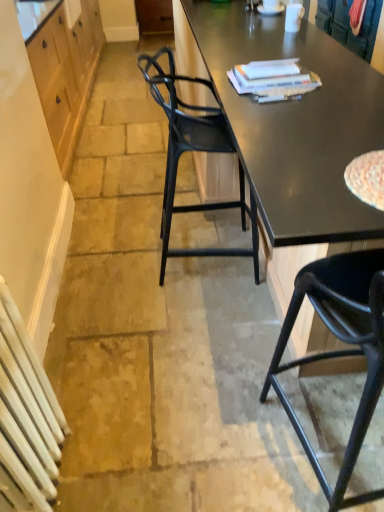
Question: Is white matte plate at upper center inside or outside of wooden cabinet at upper left?

Choices:
 (A) outside
 (B) inside

Answer: (A)

Question: Considering the positions of white matte plate at upper center and wooden cabinet at upper left in the image, is white matte plate at upper center bigger or smaller than wooden cabinet at upper left?

Choices:
 (A) small
 (B) big

Answer: (A)

Question: Which object is positioned farthest from the black plastic chair at lower right, placed as the 1th chair when sorted from front to back?

Choices:
 (A) white matte plate at upper center
 (B) wooden cabinet at left
 (C) white glossy coffee cup at upper center
 (D) wooden cabinet at upper left
 (E) black plastic chair at center, the first chair viewed from the back

Answer: (A)

Question: Which object is the closest to the wooden cabinet at upper left?

Choices:
 (A) white matte plate at upper center
 (B) white glossy coffee cup at upper center
 (C) black plastic chair at center, acting as the 2th chair starting from the front
 (D) white painted metal radiator at lower left
 (E) black glossy desk at center

Answer: (C)